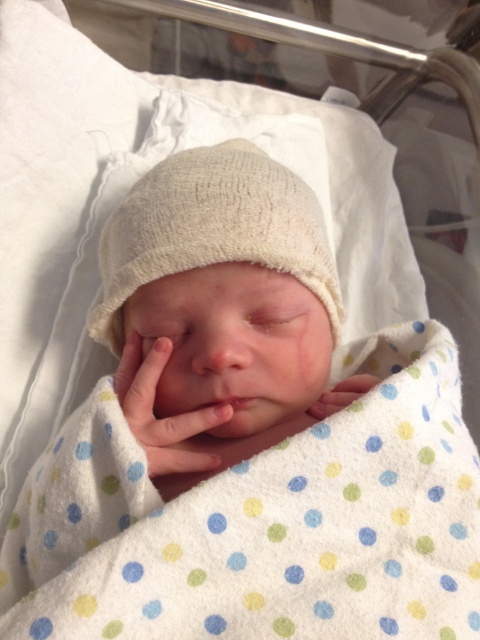
You are a nurse checking the baby in the hospital. You need to ensure the soft white knit at center and the smooth skin hand at center are positioned correctly. Based on their sizes, which object should you adjust to make sure there is enough space for the baby?

The soft white knit at center is wider than the smooth skin hand at center. To ensure enough space for the baby, adjust the soft white knit at center since it takes up more width.

You are a nurse in a hospital. You need to place a small medical kit on the bed where the baby is sleeping. The medical kit requires a flat, unobstructed area. Is the area at point (162, 417) suitable for placing the medical kit?

The area at point (162, 417) has soft white knit at center, so it is not suitable for placing the medical kit because the surface is not flat and unobstructed.

You are a nurse in a hospital. You need to place a medical chart on the bed near the white knitted hat at center. Where should you place the chart so it is 10 cm to the left of the hat?

The medical chart should be placed 10 cm to the left of the white knitted hat at center, which is at coordinates approximately 0.359 minus 0.100 in the x direction, so at x coordinate 0.259, same y coordinate 0.444.